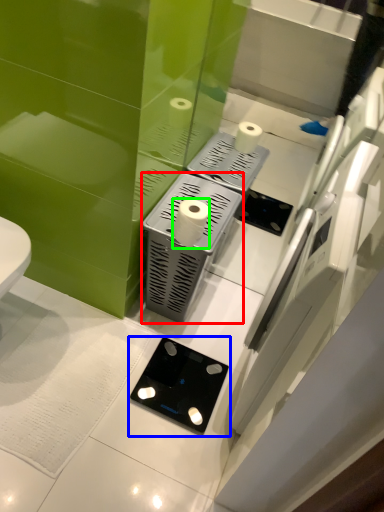
Question: Which is farther away from appliance (highlighted by a red box)? gadget (highlighted by a blue box) or toilet paper (highlighted by a green box)?

Choices:
 (A) gadget
 (B) toilet paper

Answer: (A)